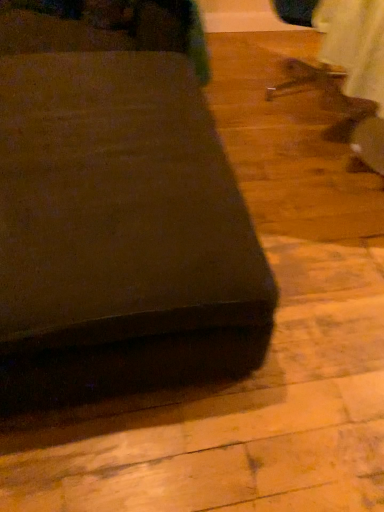
What do you see at coordinates (117, 224) in the screenshot?
I see `matte black ottoman at lower left` at bounding box center [117, 224].

Find the location of a particular element. The height and width of the screenshot is (512, 384). matte black ottoman at lower left is located at coordinates (117, 224).

Find the location of `matte black ottoman at lower left`. matte black ottoman at lower left is located at coordinates (117, 224).